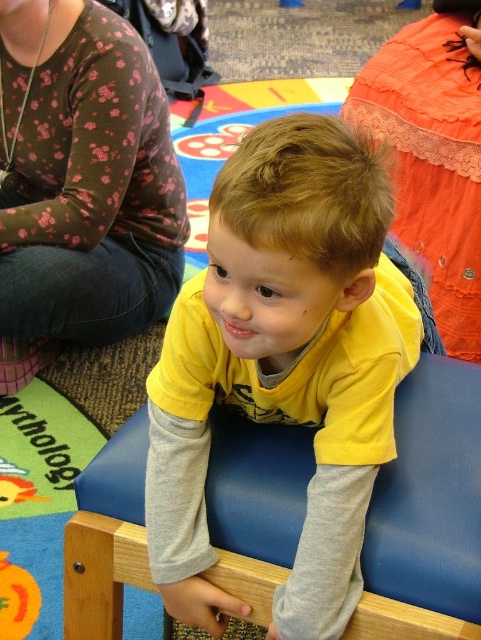
Can you confirm if yellow matte shirt at center is positioned to the right of orange lace dress at upper right?

No, yellow matte shirt at center is not to the right of orange lace dress at upper right.

Who is more forward, [157,420] or [453,74]?

Point [157,420] is in front.

Image resolution: width=481 pixels, height=640 pixels. I want to click on yellow matte shirt at center, so click(x=285, y=362).

This screenshot has width=481, height=640. Find the location of `yellow matte shirt at center`. yellow matte shirt at center is located at coordinates (285, 362).

In the scene shown: Is wooden chair at center positioned in front of orange lace dress at upper right?

Yes, wooden chair at center is in front of orange lace dress at upper right.

Can you confirm if wooden chair at center is thinner than orange lace dress at upper right?

In fact, wooden chair at center might be wider than orange lace dress at upper right.

Which is in front, point (282, 545) or point (371, 131)?

Point (282, 545)

Find the location of a particular element. The width and height of the screenshot is (481, 640). wooden chair at center is located at coordinates (430, 493).

Which is behind, point (90, 289) or point (401, 467)?

Point (90, 289)

Who is positioned more to the left, floral print sweater at upper left or wooden chair at center?

From the viewer's perspective, floral print sweater at upper left appears more on the left side.

The height and width of the screenshot is (640, 481). In order to click on floral print sweater at upper left in this screenshot , I will do `click(81, 182)`.